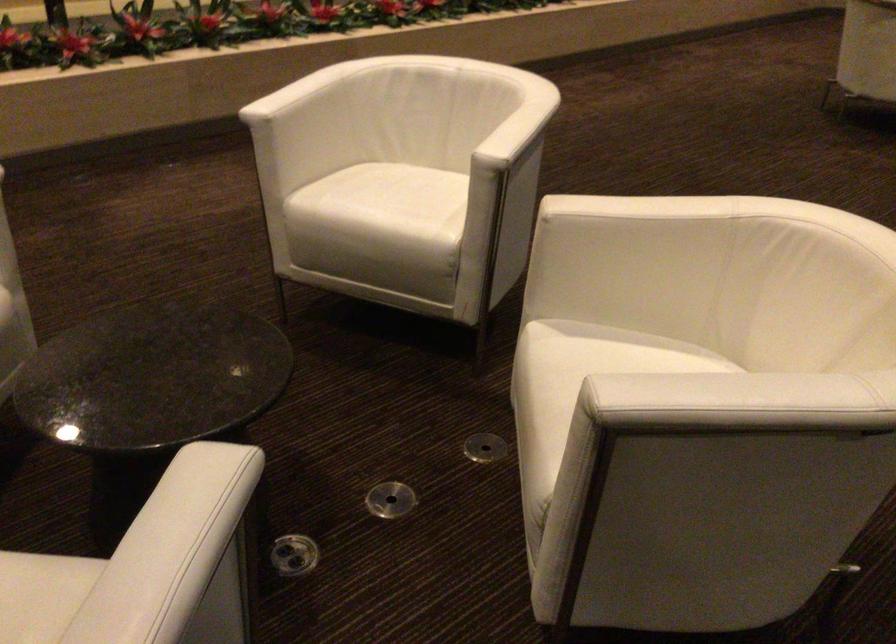
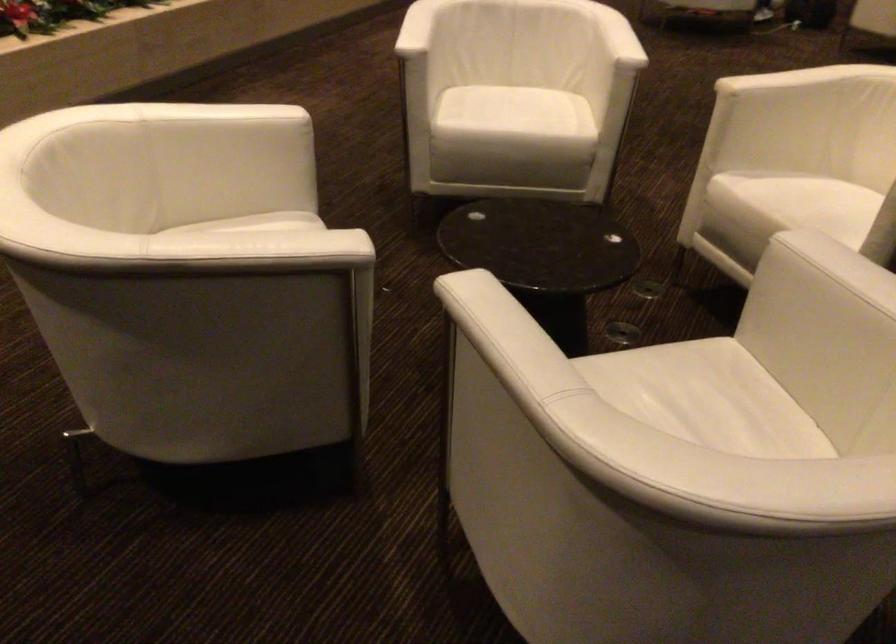
The point at (392, 209) is marked in the first image. Where is the corresponding point in the second image?

(524, 117)